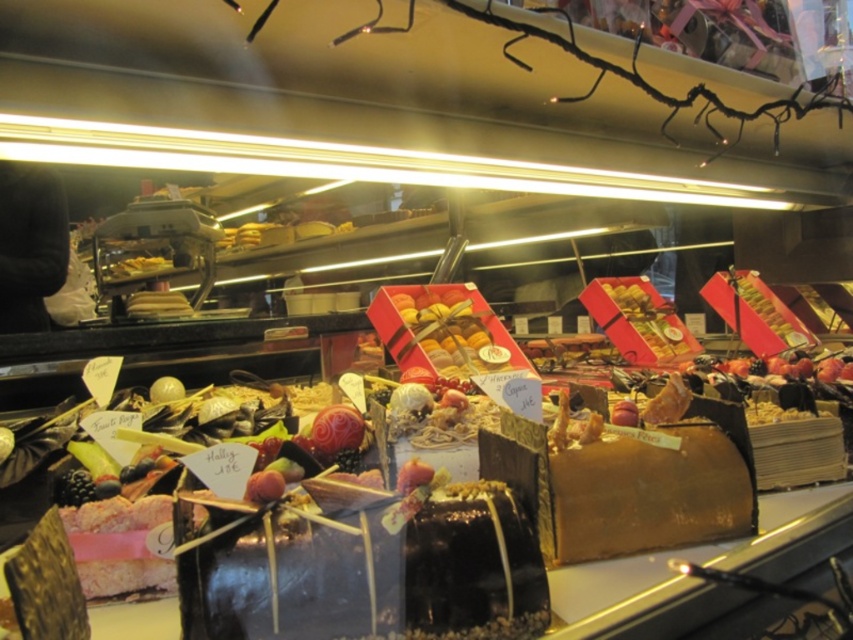
Question: Which point is farther from the camera taking this photo?

Choices:
 (A) (368, 618)
 (B) (570, 481)

Answer: (B)

Question: Observing the image, what is the correct spatial positioning of chocolate glazed cake at center in reference to golden textured cake at center?

Choices:
 (A) left
 (B) right

Answer: (A)

Question: Which object is farther from the camera taking this photo?

Choices:
 (A) chocolate glazed cake at center
 (B) golden textured cake at center

Answer: (B)

Question: Is chocolate glazed cake at center wider than golden textured cake at center?

Choices:
 (A) no
 (B) yes

Answer: (A)

Question: Does chocolate glazed cake at center appear on the right side of golden textured cake at center?

Choices:
 (A) yes
 (B) no

Answer: (B)

Question: Among these objects, which one is nearest to the camera?

Choices:
 (A) chocolate glazed cake at center
 (B) golden textured cake at center

Answer: (A)